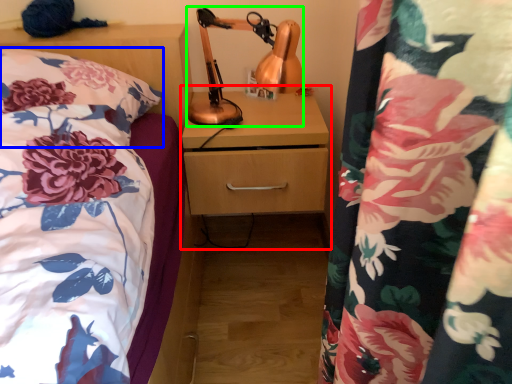
Question: Considering the real-world distances, which object is closest to dresser (highlighted by a red box)? pillow (highlighted by a blue box) or table lamp (highlighted by a green box).

Choices:
 (A) pillow
 (B) table lamp

Answer: (B)